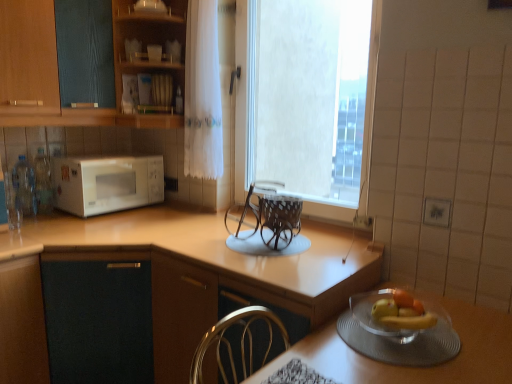
Locate an element on the screen. Image resolution: width=512 pixels, height=384 pixels. free spot to the left of brown woven basket at center is located at coordinates (205, 241).